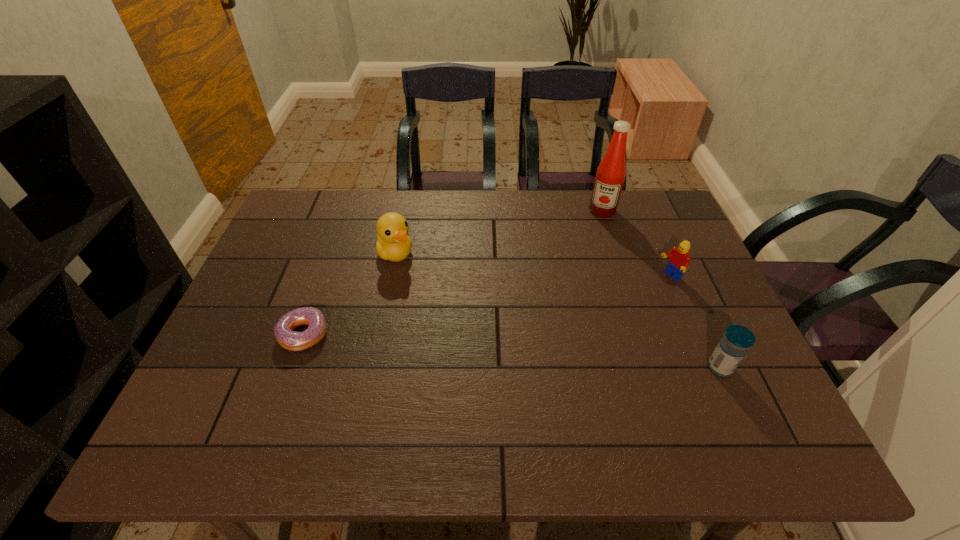
This screenshot has width=960, height=540. I want to click on vacant space on the desktop that is between the shortest object and the medicine and is positioned on the face of the second tallest object, so click(497, 349).

At what (x,y) coordinates should I click in order to perform the action: click on free spot on the desktop that is between the shortest object and the nearest object and is positioned on the front-facing side of the Lego. Please return your answer as a coordinate pair (x, y). Looking at the image, I should click on (536, 353).

Find the location of a particular element. The image size is (960, 540). free space on the desktop that is between the doughnut and the nearest object and is positioned on the front-facing side of the farthest object is located at coordinates tap(554, 354).